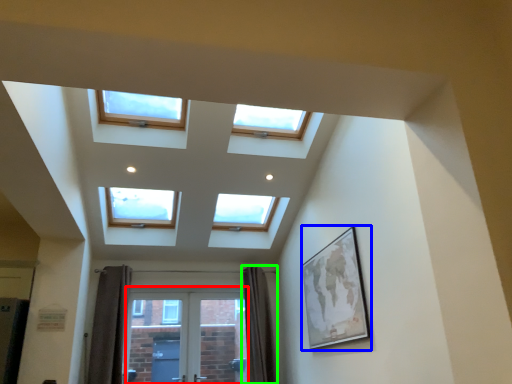
Question: Considering the real-world distances, which object is farthest from screen door (highlighted by a red box)? picture frame (highlighted by a blue box) or curtain (highlighted by a green box)?

Choices:
 (A) picture frame
 (B) curtain

Answer: (A)